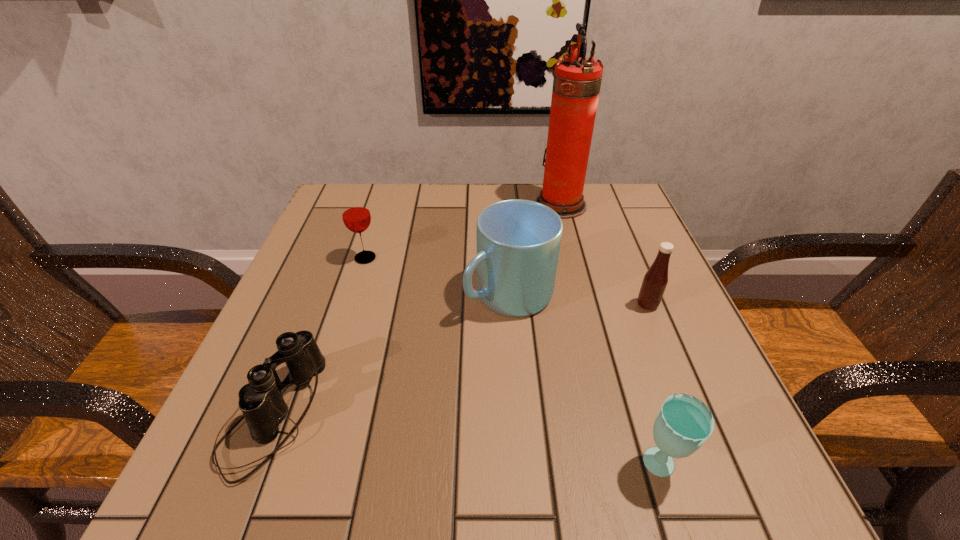
Find the location of a particular element. The height and width of the screenshot is (540, 960). object that is the closest to the binoculars is located at coordinates pyautogui.click(x=518, y=241).

Where is `vacant region that satisfies the following two spatial constraints: 1. at the discharge end of the fire extinguisher; 2. on the back side of the rightmost object`? The width and height of the screenshot is (960, 540). vacant region that satisfies the following two spatial constraints: 1. at the discharge end of the fire extinguisher; 2. on the back side of the rightmost object is located at coordinates (587, 305).

Where is `vacant area that satisfies the following two spatial constraints: 1. at the discharge end of the nearer glass; 2. on the right side of the tallest object`? This screenshot has width=960, height=540. vacant area that satisfies the following two spatial constraints: 1. at the discharge end of the nearer glass; 2. on the right side of the tallest object is located at coordinates pos(628,467).

The image size is (960, 540). I want to click on vacant space that satisfies the following two spatial constraints: 1. on the front side of the Tabasco sauce; 2. on the right side of the mug, so click(510, 305).

Identify the location of free region that satisfies the following two spatial constraints: 1. at the discharge end of the tallest object; 2. on the left side of the rightmost object. (587, 305).

Locate an element on the screen. This screenshot has height=540, width=960. free region that satisfies the following two spatial constraints: 1. at the discharge end of the Tabasco sauce; 2. on the right side of the fire extinguisher is located at coordinates (587, 305).